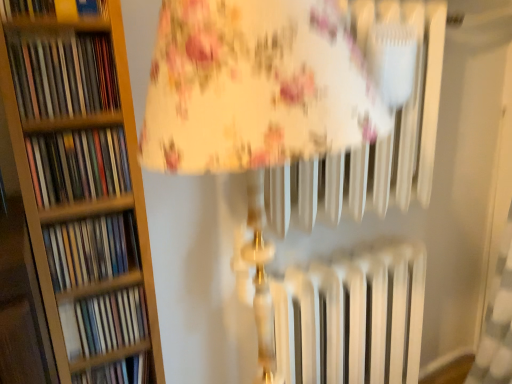
Measure the distance between point [22,117] and camera.

Point [22,117] and camera are 27.48 inches apart.

This screenshot has height=384, width=512. Describe the element at coordinates (117, 372) in the screenshot. I see `matte cardboard book at left, acting as the sixth book starting from the top` at that location.

The height and width of the screenshot is (384, 512). I want to click on matte plastic book at left, the fifth book in the top-to-bottom sequence, so [111, 321].

Describe the element at coordinates (91, 250) in the screenshot. I see `matte plastic books at left, which is the fourth book in top-to-bottom order` at that location.

Where is `matte plastic books at left, which is counted as the 5th book, starting from the bottom`? This screenshot has height=384, width=512. matte plastic books at left, which is counted as the 5th book, starting from the bottom is located at coordinates (63, 75).

Can you confirm if matte plastic books at left, which is counted as the 5th book, starting from the bottom, is taller than multicolored paperbacks at left, the 4th book positioned from the bottom?

Yes.

Is point (106, 75) closer to viewer compared to point (106, 133)?

Yes, point (106, 75) is in front of point (106, 133).

Does matte plastic books at left, which is counted as the 5th book, starting from the bottom, have a lesser width compared to multicolored paperbacks at left, the third book in the top-to-bottom sequence?

No, matte plastic books at left, which is counted as the 5th book, starting from the bottom, is not thinner than multicolored paperbacks at left, the third book in the top-to-bottom sequence.

Can you confirm if matte plastic book at left, the 2th book positioned from the bottom, is bigger than matte cardboard book at left, acting as the sixth book starting from the top?

Actually, matte plastic book at left, the 2th book positioned from the bottom, might be smaller than matte cardboard book at left, acting as the sixth book starting from the top.

Consider the image. From the image's perspective, is matte plastic book at left, the fifth book in the top-to-bottom sequence, under matte cardboard book at left, which appears as the first book when ordered from the bottom?

Incorrect, from the image's perspective, matte plastic book at left, the fifth book in the top-to-bottom sequence, is higher than matte cardboard book at left, which appears as the first book when ordered from the bottom.

Considering the sizes of objects matte plastic book at left, the fifth book in the top-to-bottom sequence, and matte cardboard book at left, which appears as the first book when ordered from the bottom, in the image provided, who is shorter, matte plastic book at left, the fifth book in the top-to-bottom sequence, or matte cardboard book at left, which appears as the first book when ordered from the bottom,?

Standing shorter between the two is matte cardboard book at left, which appears as the first book when ordered from the bottom.

Would you say matte cardboard book at left, acting as the sixth book starting from the top, is part of matte plastic book at left, the 2th book positioned from the bottom,'s contents?

No, matte cardboard book at left, acting as the sixth book starting from the top, is not a part of matte plastic book at left, the 2th book positioned from the bottom.

What's the angular difference between matte cardboard book at left, which appears as the first book when ordered from the bottom, and matte plastic books at left, which is counted as the 5th book, starting from the bottom,'s facing directions?

There is a 9.31e-05-degree angle between the facing directions of matte cardboard book at left, which appears as the first book when ordered from the bottom, and matte plastic books at left, which is counted as the 5th book, starting from the bottom.

Based on their sizes in the image, would you say matte cardboard book at left, acting as the sixth book starting from the top, is bigger or smaller than matte plastic books at left, which is counted as the 5th book, starting from the bottom?

matte cardboard book at left, acting as the sixth book starting from the top, is smaller than matte plastic books at left, which is counted as the 5th book, starting from the bottom.

Can you confirm if matte cardboard book at left, which appears as the first book when ordered from the bottom, is positioned to the left of matte plastic books at left, the second book positioned from the top?

No.

Does point (134, 369) come in front of point (25, 79)?

No, (134, 369) is behind (25, 79).

Is matte cardboard book at left, acting as the sixth book starting from the top, oriented towards multicolored paperbacks at left, the 4th book positioned from the bottom?

No.

Considering their positions, is matte cardboard book at left, acting as the sixth book starting from the top, located in front of or behind multicolored paperbacks at left, the third book in the top-to-bottom sequence?

In the image, matte cardboard book at left, acting as the sixth book starting from the top, appears behind multicolored paperbacks at left, the third book in the top-to-bottom sequence.

From the image's perspective, is matte cardboard book at left, which appears as the first book when ordered from the bottom, over multicolored paperbacks at left, the third book in the top-to-bottom sequence?

No, from the image's perspective, matte cardboard book at left, which appears as the first book when ordered from the bottom, is not above multicolored paperbacks at left, the third book in the top-to-bottom sequence.

Is matte cardboard book at left, acting as the sixth book starting from the top, far from multicolored paperbacks at left, the 4th book positioned from the bottom?

No, matte cardboard book at left, acting as the sixth book starting from the top, is in close proximity to multicolored paperbacks at left, the 4th book positioned from the bottom.

Is point (77, 151) less distant than point (102, 379)?

Yes, point (77, 151) is in front of point (102, 379).

Which object is wider, multicolored paperbacks at left, the 4th book positioned from the bottom, or matte cardboard book at left, which appears as the first book when ordered from the bottom?

Wider between the two is matte cardboard book at left, which appears as the first book when ordered from the bottom.

From a real-world perspective, is multicolored paperbacks at left, the third book in the top-to-bottom sequence, beneath matte cardboard book at left, acting as the sixth book starting from the top?

No, from a real-world perspective, multicolored paperbacks at left, the third book in the top-to-bottom sequence, is not beneath matte cardboard book at left, acting as the sixth book starting from the top.

Which book is the 3rd one when counting from the back of the multicolored paperbacks at left, the 4th book positioned from the bottom? Please provide its 2D coordinates.

[(117, 372)]

Considering the relative positions of hardcover book at upper left, the first book from the top, and matte cardboard book at left, acting as the sixth book starting from the top, in the image provided, is hardcover book at upper left, the first book from the top, to the left of matte cardboard book at left, acting as the sixth book starting from the top, from the viewer's perspective?

Yes.

Which object is more forward, hardcover book at upper left, the 6th book when ordered from bottom to top, or matte cardboard book at left, which appears as the first book when ordered from the bottom?

hardcover book at upper left, the 6th book when ordered from bottom to top, is closer to the camera.

From the image's perspective, is hardcover book at upper left, the 6th book when ordered from bottom to top, positioned above or below matte cardboard book at left, acting as the sixth book starting from the top?

From the image's perspective, hardcover book at upper left, the 6th book when ordered from bottom to top, appears above matte cardboard book at left, acting as the sixth book starting from the top.

Could you tell me if hardcover book at upper left, the first book from the top, is facing matte cardboard book at left, acting as the sixth book starting from the top?

No, hardcover book at upper left, the first book from the top, is not facing towards matte cardboard book at left, acting as the sixth book starting from the top.

Considering the relative sizes of multicolored paperbacks at left, the third book in the top-to-bottom sequence, and matte plastic books at left, the second book positioned from the top, in the image provided, is multicolored paperbacks at left, the third book in the top-to-bottom sequence, shorter than matte plastic books at left, the second book positioned from the top,?

Yes, multicolored paperbacks at left, the third book in the top-to-bottom sequence, is shorter than matte plastic books at left, the second book positioned from the top.

Would you say multicolored paperbacks at left, the 4th book positioned from the bottom, is to the left or to the right of matte plastic books at left, the second book positioned from the top, in the picture?

Based on their positions, multicolored paperbacks at left, the 4th book positioned from the bottom, is located to the right of matte plastic books at left, the second book positioned from the top.

From the image's perspective, would you say multicolored paperbacks at left, the third book in the top-to-bottom sequence, is shown under matte plastic books at left, which is counted as the 5th book, starting from the bottom?

Yes.

Is multicolored paperbacks at left, the third book in the top-to-bottom sequence, not within matte plastic books at left, the second book positioned from the top?

Indeed, multicolored paperbacks at left, the third book in the top-to-bottom sequence, is completely outside matte plastic books at left, the second book positioned from the top.

Identify the location of the 1st book behind the matte plastic books at left, which is counted as the 5th book, starting from the bottom. (78, 165).

Where is `the 1st book in front of the matte cardboard book at left, acting as the sixth book starting from the top, counting from the anchor's position`? This screenshot has width=512, height=384. the 1st book in front of the matte cardboard book at left, acting as the sixth book starting from the top, counting from the anchor's position is located at coordinates (111, 321).

Which object lies further to the anchor point matte plastic books at left, the second book positioned from the top, multicolored paperbacks at left, the 4th book positioned from the bottom, or matte plastic book at left, the fifth book in the top-to-bottom sequence?

matte plastic book at left, the fifth book in the top-to-bottom sequence.

Which object lies further to the anchor point hardcover book at upper left, the 6th book when ordered from bottom to top, matte plastic books at left, the second book positioned from the top, or matte cardboard book at left, acting as the sixth book starting from the top?

Based on the image, matte cardboard book at left, acting as the sixth book starting from the top, appears to be further to hardcover book at upper left, the 6th book when ordered from bottom to top.

Based on their spatial positions, is matte cardboard book at left, acting as the sixth book starting from the top, or matte plastic books at left, which is the fourth book in top-to-bottom order, closer to matte plastic book at left, the 2th book positioned from the bottom?

matte cardboard book at left, acting as the sixth book starting from the top.

When comparing their distances from hardcover book at upper left, the 6th book when ordered from bottom to top, does matte cardboard book at left, which appears as the first book when ordered from the bottom, or multicolored paperbacks at left, the third book in the top-to-bottom sequence, seem further?

Among the two, matte cardboard book at left, which appears as the first book when ordered from the bottom, is located further to hardcover book at upper left, the 6th book when ordered from bottom to top.

From the picture: From the image, which object appears to be nearer to matte plastic books at left, which is the fourth book in top-to-bottom order, multicolored paperbacks at left, the 4th book positioned from the bottom, or matte plastic book at left, the fifth book in the top-to-bottom sequence?

matte plastic book at left, the fifth book in the top-to-bottom sequence, is closer to matte plastic books at left, which is the fourth book in top-to-bottom order.

When comparing their distances from matte plastic book at left, the fifth book in the top-to-bottom sequence, does multicolored paperbacks at left, the 4th book positioned from the bottom, or matte plastic books at left, which is the fourth book in top-to-bottom order, seem further?

multicolored paperbacks at left, the 4th book positioned from the bottom, lies further to matte plastic book at left, the fifth book in the top-to-bottom sequence, than the other object.

From the image, which object appears to be farther from matte plastic books at left, which is the fourth book in top-to-bottom order, matte plastic book at left, the 2th book positioned from the bottom, or matte plastic books at left, which is counted as the 5th book, starting from the bottom?

matte plastic books at left, which is counted as the 5th book, starting from the bottom, lies further to matte plastic books at left, which is the fourth book in top-to-bottom order, than the other object.

When comparing their distances from matte plastic books at left, the second book positioned from the top, does matte plastic book at left, the fifth book in the top-to-bottom sequence, or matte plastic books at left, which is the fourth book in top-to-bottom order, seem closer?

matte plastic books at left, which is the fourth book in top-to-bottom order.

The height and width of the screenshot is (384, 512). I want to click on book between multicolored paperbacks at left, the 4th book positioned from the bottom, and matte plastic book at left, the fifth book in the top-to-bottom sequence, vertically, so click(91, 250).

Image resolution: width=512 pixels, height=384 pixels. Find the location of `book between matte plastic books at left, the second book positioned from the top, and matte plastic books at left, which is the fourth book in top-to-bottom order, in the vertical direction`. book between matte plastic books at left, the second book positioned from the top, and matte plastic books at left, which is the fourth book in top-to-bottom order, in the vertical direction is located at coordinates (78, 165).

At what (x,y) coordinates should I click in order to perform the action: click on book between matte plastic books at left, which is the fourth book in top-to-bottom order, and matte cardboard book at left, acting as the sixth book starting from the top, vertically. Please return your answer as a coordinate pair (x, y). Looking at the image, I should click on (111, 321).

Where is `book between hardcover book at upper left, the first book from the top, and multicolored paperbacks at left, the 4th book positioned from the bottom, from top to bottom`? Image resolution: width=512 pixels, height=384 pixels. book between hardcover book at upper left, the first book from the top, and multicolored paperbacks at left, the 4th book positioned from the bottom, from top to bottom is located at coordinates (63, 75).